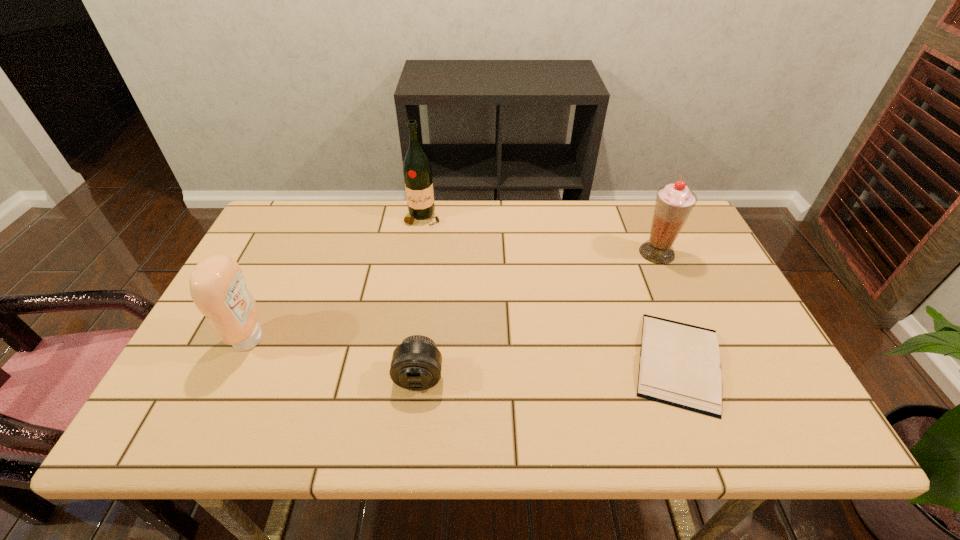
At what (x,y) coordinates should I click in order to perform the action: click on the tallest object. Please return your answer as a coordinate pair (x, y). Image resolution: width=960 pixels, height=540 pixels. Looking at the image, I should click on (417, 172).

At what (x,y) coordinates should I click in order to perform the action: click on the farthest object. Please return your answer as a coordinate pair (x, y). Image resolution: width=960 pixels, height=540 pixels. Looking at the image, I should click on [417, 172].

Locate an element on the screen. The image size is (960, 540). smoothie is located at coordinates (674, 202).

Locate an element on the screen. The height and width of the screenshot is (540, 960). the leftmost object is located at coordinates (218, 288).

Locate an element on the screen. This screenshot has width=960, height=540. the second shortest object is located at coordinates (416, 364).

The height and width of the screenshot is (540, 960). I want to click on the shortest object, so click(679, 364).

Identify the location of blank space located 0.340m on the surface of the farthest object. (409, 309).

Locate an element on the screen. The width and height of the screenshot is (960, 540). vacant region located 0.240m on the left of the fourth nearest object is located at coordinates (558, 253).

The width and height of the screenshot is (960, 540). What are the coordinates of `vacant region located on the label of the leftmost object` in the screenshot? It's located at (372, 339).

You are a GUI agent. You are given a task and a screenshot of the screen. Output one action in this format:
    pyautogui.click(x=<x>, y=<y>)
    Task: Click on the free space located on the front-facing side of the telephoto lens
    This screenshot has height=540, width=960.
    Given the screenshot: What is the action you would take?
    pyautogui.click(x=412, y=440)